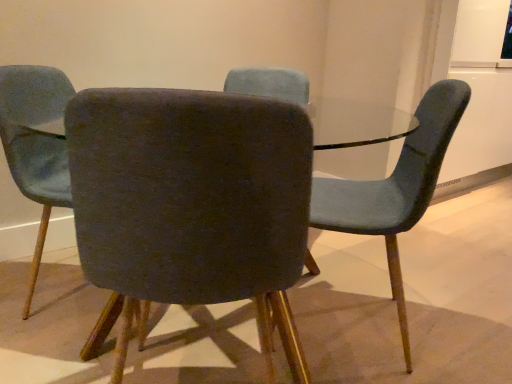
Question: Is velvet dark gray chair at center, which appears as the third chair when viewed from the right, at the left side of velvet dark gray chair at center, acting as the 2th chair starting from the right?

Choices:
 (A) no
 (B) yes

Answer: (B)

Question: Considering the relative sizes of velvet dark gray chair at center, marked as the 1th chair in a left-to-right arrangement, and velvet dark gray chair at center, the second chair from the left, in the image provided, is velvet dark gray chair at center, marked as the 1th chair in a left-to-right arrangement, wider than velvet dark gray chair at center, the second chair from the left,?

Choices:
 (A) no
 (B) yes

Answer: (A)

Question: Is velvet dark gray chair at center, which appears as the third chair when viewed from the right, bigger than velvet dark gray chair at center, the second chair from the left?

Choices:
 (A) no
 (B) yes

Answer: (A)

Question: Is velvet dark gray chair at center, the second chair from the left, a part of velvet dark gray chair at center, marked as the 1th chair in a left-to-right arrangement?

Choices:
 (A) no
 (B) yes

Answer: (A)

Question: From a real-world perspective, is velvet dark gray chair at center, which appears as the third chair when viewed from the right, physically below velvet dark gray chair at center, acting as the 2th chair starting from the right?

Choices:
 (A) yes
 (B) no

Answer: (B)

Question: From the image's perspective, is velvet dark gray chair at center, marked as the 1th chair in a left-to-right arrangement, above or below velvet dark gray chair at center, acting as the 2th chair starting from the right?

Choices:
 (A) above
 (B) below

Answer: (A)

Question: Looking at their shapes, would you say velvet dark gray chair at center, marked as the 1th chair in a left-to-right arrangement, is wider or thinner than velvet dark gray chair at center, acting as the 2th chair starting from the right?

Choices:
 (A) thin
 (B) wide

Answer: (A)

Question: Is point (24, 195) positioned closer to the camera than point (94, 190)?

Choices:
 (A) farther
 (B) closer

Answer: (A)

Question: In terms of height, does velvet dark gray chair at center, which appears as the third chair when viewed from the right, look taller or shorter compared to velvet dark gray chair at center, acting as the 2th chair starting from the right?

Choices:
 (A) tall
 (B) short

Answer: (A)

Question: Is point pyautogui.click(x=80, y=195) positioned closer to the camera than point pyautogui.click(x=48, y=120)?

Choices:
 (A) farther
 (B) closer

Answer: (B)

Question: Considering their positions, is velvet dark gray chair at center, the second chair from the left, located in front of or behind velvet dark gray chair at center, marked as the 1th chair in a left-to-right arrangement?

Choices:
 (A) front
 (B) behind

Answer: (A)

Question: From a real-world perspective, is velvet dark gray chair at center, acting as the 2th chair starting from the right, physically located above or below velvet dark gray chair at center, which appears as the third chair when viewed from the right?

Choices:
 (A) above
 (B) below

Answer: (B)

Question: Visually, is velvet dark gray chair at center, the second chair from the left, positioned to the left or to the right of velvet dark gray chair at center, which appears as the third chair when viewed from the right?

Choices:
 (A) right
 (B) left

Answer: (A)

Question: Considering their positions, is velvet teal chair at right, acting as the 1th chair starting from the right, located in front of or behind velvet dark gray chair at center, acting as the 2th chair starting from the right?

Choices:
 (A) behind
 (B) front

Answer: (A)

Question: From a real-world perspective, is velvet teal chair at right, the third chair from the left, above or below velvet dark gray chair at center, the second chair from the left?

Choices:
 (A) above
 (B) below

Answer: (B)